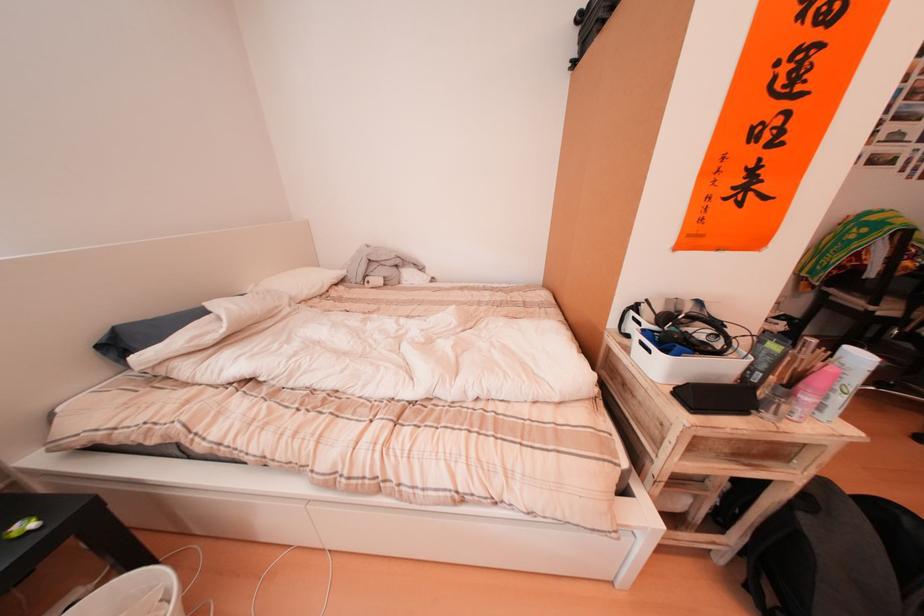
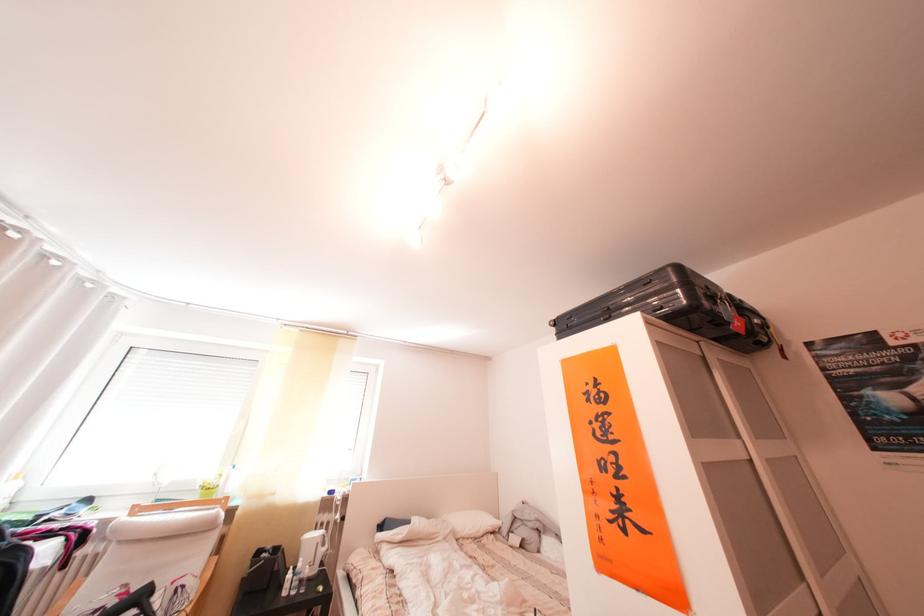
Find the pixel in the second image that matches (x=348, y=286) in the first image.

(504, 535)